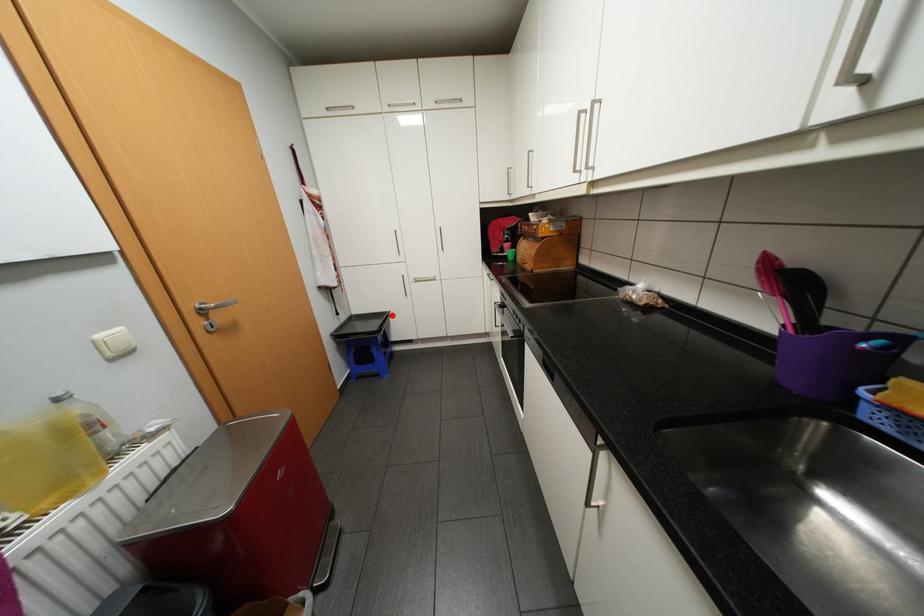
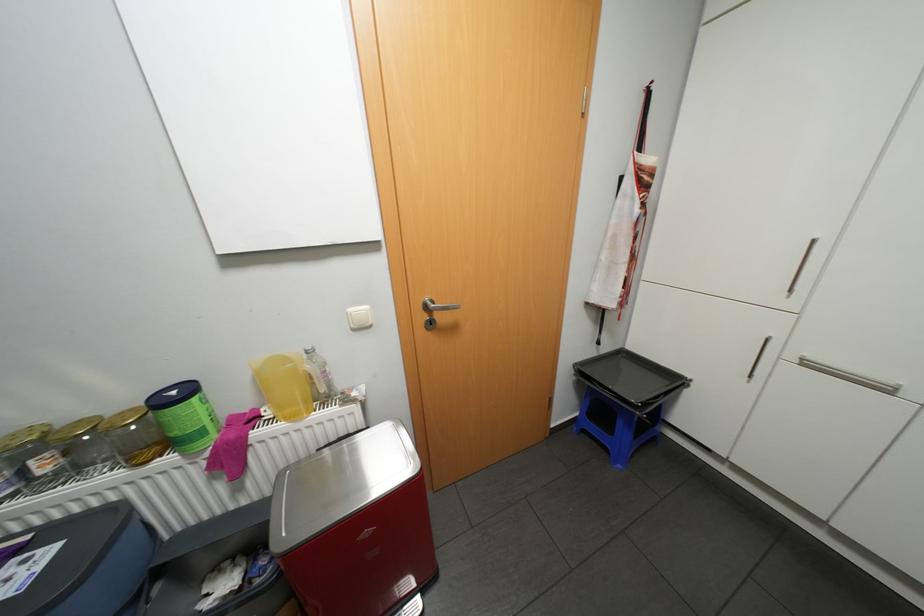
Question: I am providing you with two images of the same scene from different viewpoints. A red point is marked on the first image. Is the red point's position out of view in image 2?

Choices:
 (A) Yes
 (B) No

Answer: (B)